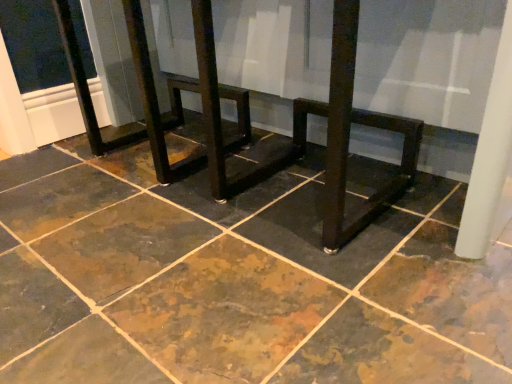
Question: Is marbled stone floor at center positioned beyond the bounds of matte dark wood table at center?

Choices:
 (A) yes
 (B) no

Answer: (A)

Question: Is marbled stone floor at center to the right of matte dark wood table at center from the viewer's perspective?

Choices:
 (A) no
 (B) yes

Answer: (A)

Question: From the image's perspective, is marbled stone floor at center under matte dark wood table at center?

Choices:
 (A) no
 (B) yes

Answer: (B)

Question: From the image's perspective, is marbled stone floor at center on matte dark wood table at center?

Choices:
 (A) no
 (B) yes

Answer: (A)

Question: Considering the relative sizes of marbled stone floor at center and matte dark wood table at center in the image provided, is marbled stone floor at center taller than matte dark wood table at center?

Choices:
 (A) no
 (B) yes

Answer: (A)

Question: Would you say matte dark wood table at center is part of marbled stone floor at center's contents?

Choices:
 (A) no
 (B) yes

Answer: (A)

Question: Is matte dark wood table at center in front of marbled stone floor at center?

Choices:
 (A) no
 (B) yes

Answer: (A)

Question: Considering the relative sizes of matte dark wood table at center and marbled stone floor at center in the image provided, is matte dark wood table at center bigger than marbled stone floor at center?

Choices:
 (A) yes
 (B) no

Answer: (B)

Question: Can you confirm if matte dark wood table at center is taller than marbled stone floor at center?

Choices:
 (A) yes
 (B) no

Answer: (A)

Question: Is matte dark wood table at center at the left side of marbled stone floor at center?

Choices:
 (A) yes
 (B) no

Answer: (B)

Question: Can you confirm if matte dark wood table at center is wider than marbled stone floor at center?

Choices:
 (A) yes
 (B) no

Answer: (B)

Question: Can you confirm if matte dark wood table at center is smaller than marbled stone floor at center?

Choices:
 (A) no
 (B) yes

Answer: (B)

Question: From the image's perspective, is matte dark wood table at center positioned above or below marbled stone floor at center?

Choices:
 (A) below
 (B) above

Answer: (B)